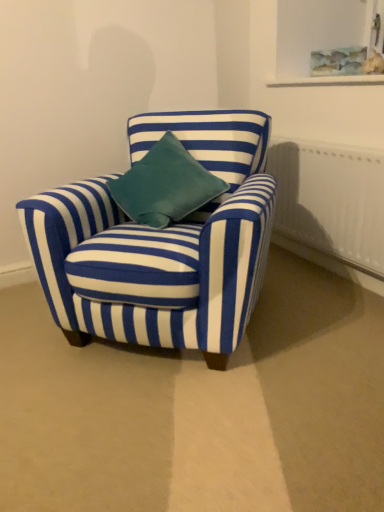
What are the coordinates of `blue striped fabric chair at center` in the screenshot? It's located at (161, 243).

This screenshot has height=512, width=384. What do you see at coordinates (161, 243) in the screenshot?
I see `blue striped fabric chair at center` at bounding box center [161, 243].

Locate an element on the screen. The width and height of the screenshot is (384, 512). white textured radiator at right is located at coordinates (331, 202).

The width and height of the screenshot is (384, 512). What do you see at coordinates (331, 202) in the screenshot?
I see `white textured radiator at right` at bounding box center [331, 202].

Where is `blue striped fabric chair at center`? blue striped fabric chair at center is located at coordinates (161, 243).

Which object is positioned more to the right, white textured radiator at right or blue striped fabric chair at center?

white textured radiator at right.

Which object is further away from the camera taking this photo, white textured radiator at right or blue striped fabric chair at center?

Positioned behind is white textured radiator at right.

Which point is more forward, (x=364, y=170) or (x=222, y=297)?

The point (x=222, y=297) is closer.

From the image's perspective, which object appears higher, white textured radiator at right or blue striped fabric chair at center?

white textured radiator at right, from the image's perspective.

From a real-world perspective, between white textured radiator at right and blue striped fabric chair at center, who is vertically lower?

white textured radiator at right, from a real-world perspective.

Does white textured radiator at right have a lesser width compared to blue striped fabric chair at center?

Yes, white textured radiator at right is thinner than blue striped fabric chair at center.

Which of these two, white textured radiator at right or blue striped fabric chair at center, stands shorter?

With less height is white textured radiator at right.

Who is bigger, white textured radiator at right or blue striped fabric chair at center?

blue striped fabric chair at center is bigger.

Is white textured radiator at right positioned beyond the bounds of blue striped fabric chair at center?

white textured radiator at right lies outside blue striped fabric chair at center's area.

Is white textured radiator at right far away from blue striped fabric chair at center?

white textured radiator at right is actually quite close to blue striped fabric chair at center.

Based on the photo, could you tell me if white textured radiator at right is facing blue striped fabric chair at center?

Yes, white textured radiator at right is oriented towards blue striped fabric chair at center.

How many degrees apart are the facing directions of white textured radiator at right and blue striped fabric chair at center?

They differ by 42.2 degrees in their facing directions.

Measure the distance from white textured radiator at right to blue striped fabric chair at center.

white textured radiator at right and blue striped fabric chair at center are 27.70 inches apart.

Where is `radiator beneath the blue striped fabric chair at center (from a real-world perspective)`? This screenshot has width=384, height=512. radiator beneath the blue striped fabric chair at center (from a real-world perspective) is located at coordinates (331, 202).

Considering the positions of objects blue striped fabric chair at center and white textured radiator at right in the image provided, who is more to the left, blue striped fabric chair at center or white textured radiator at right?

Positioned to the left is blue striped fabric chair at center.

Between blue striped fabric chair at center and white textured radiator at right, which one is positioned behind?

Positioned behind is white textured radiator at right.

Which point is more forward, (244, 118) or (279, 208)?

The point (244, 118) is closer.

From the image's perspective, between blue striped fabric chair at center and white textured radiator at right, which one is located above?

white textured radiator at right is shown above in the image.

From a real-world perspective, is blue striped fabric chair at center over white textured radiator at right?

Yes, from a real-world perspective, blue striped fabric chair at center is above white textured radiator at right.

Does blue striped fabric chair at center have a greater width compared to white textured radiator at right?

Yes.

Is blue striped fabric chair at center taller or shorter than white textured radiator at right?

Clearly, blue striped fabric chair at center is taller compared to white textured radiator at right.

Who is smaller, blue striped fabric chair at center or white textured radiator at right?

Smaller between the two is white textured radiator at right.

Would you say white textured radiator at right is part of blue striped fabric chair at center's contents?

No, blue striped fabric chair at center does not contain white textured radiator at right.

Is blue striped fabric chair at center far from white textured radiator at right?

They are positioned close to each other.

Is blue striped fabric chair at center oriented away from white textured radiator at right?

No, blue striped fabric chair at center is not facing the opposite direction of white textured radiator at right.

How many degrees apart are the facing directions of blue striped fabric chair at center and white textured radiator at right?

The angular difference between blue striped fabric chair at center and white textured radiator at right is 42.2 degrees.

How much distance is there between blue striped fabric chair at center and white textured radiator at right?

blue striped fabric chair at center and white textured radiator at right are 70.36 centimeters apart.

Locate an element on the screen. The width and height of the screenshot is (384, 512). chair located below the white textured radiator at right (from the image's perspective) is located at coordinates (161, 243).

You are a GUI agent. You are given a task and a screenshot of the screen. Output one action in this format:
    pyautogui.click(x=<x>, y=<y>)
    Task: Click on the radiator that appears behind the blue striped fabric chair at center
    
    Given the screenshot: What is the action you would take?
    (x=331, y=202)

Where is `chair above the white textured radiator at right (from a real-world perspective)`? The image size is (384, 512). chair above the white textured radiator at right (from a real-world perspective) is located at coordinates (161, 243).